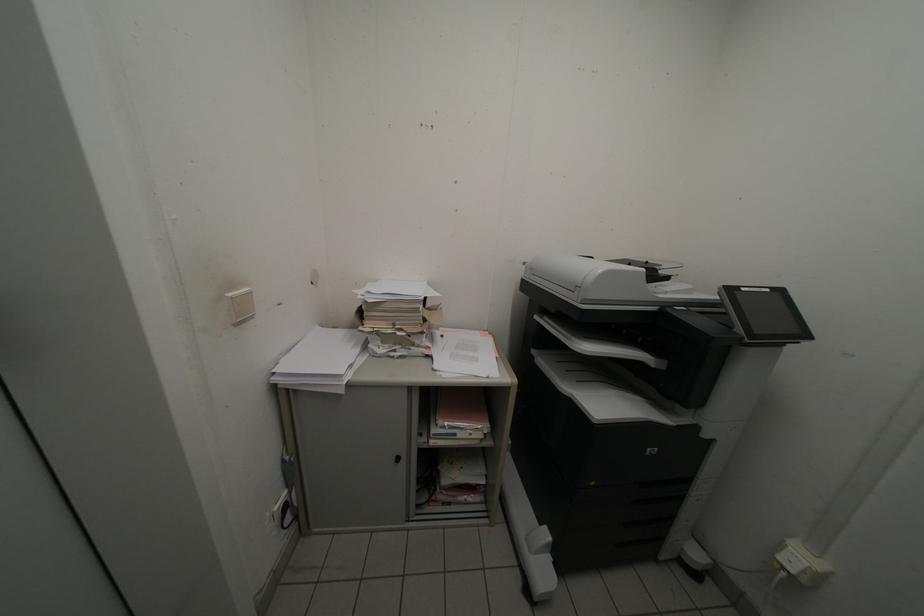
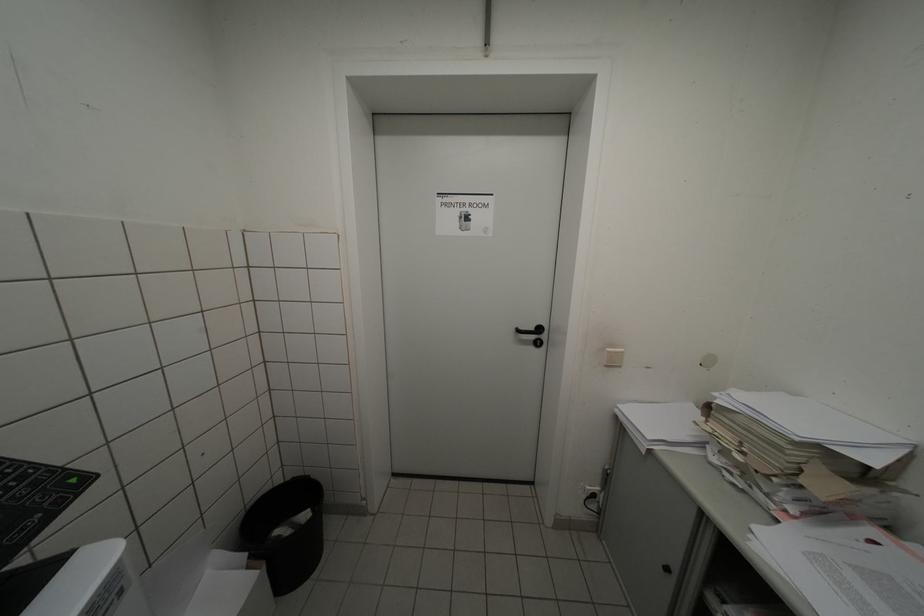
Locate, in the second image, the point that corresponds to point 237,297 in the first image.

(615, 352)